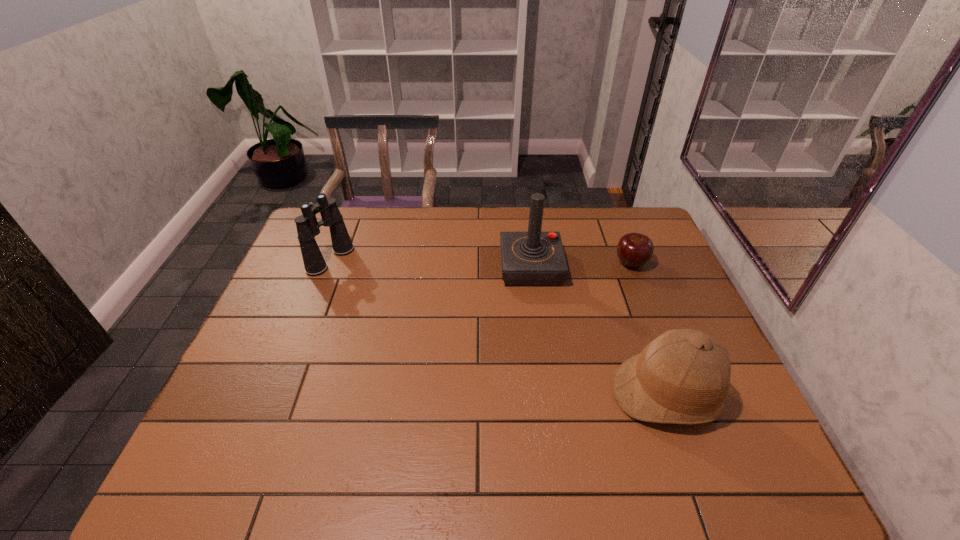
This screenshot has height=540, width=960. Identify the location of empty space that is in between the shortest object and the nearest object. (649, 329).

At what (x,y) coordinates should I click in order to perform the action: click on vacant space that is in between the nearest object and the leftmost object. Please return your answer as a coordinate pair (x, y). Looking at the image, I should click on (499, 327).

Identify the location of unoccupied area between the third object from right to left and the hat. This screenshot has width=960, height=540. (599, 331).

At what (x,y) coordinates should I click in order to perform the action: click on free space between the leftmost object and the shortest object. Please return your answer as a coordinate pair (x, y). Looking at the image, I should click on (481, 261).

Locate an element on the screen. free space between the apple and the joystick is located at coordinates (581, 265).

I want to click on vacant area that lies between the hat and the binoculars, so click(499, 327).

Where is `free space between the shortest object and the binoculars`? The height and width of the screenshot is (540, 960). free space between the shortest object and the binoculars is located at coordinates (481, 261).

Locate an element on the screen. free spot between the joystick and the leftmost object is located at coordinates (431, 264).

This screenshot has height=540, width=960. In order to click on empty location between the apple and the binoculars in this screenshot , I will do `click(481, 261)`.

Identify which object is located as the second nearest to the apple. Please provide its 2D coordinates. Your answer should be formatted as a tuple, i.e. [(x, y)], where the tuple contains the x and y coordinates of a point satisfying the conditions above.

[(683, 376)]